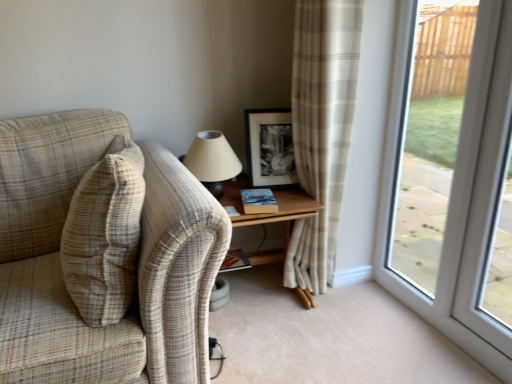
Question: Is black matte picture frame at upper center closer to camera compared to matte beige lampshade at upper center?

Choices:
 (A) yes
 (B) no

Answer: (B)

Question: Does black matte picture frame at upper center have a greater width compared to matte beige lampshade at upper center?

Choices:
 (A) no
 (B) yes

Answer: (A)

Question: From a real-world perspective, is black matte picture frame at upper center physically below matte beige lampshade at upper center?

Choices:
 (A) no
 (B) yes

Answer: (A)

Question: Is matte beige lampshade at upper center at the back of black matte picture frame at upper center?

Choices:
 (A) yes
 (B) no

Answer: (B)

Question: Is black matte picture frame at upper center further to camera compared to matte beige lampshade at upper center?

Choices:
 (A) no
 (B) yes

Answer: (B)

Question: Do you think hardcover book at center, the second book viewed from the left, is within black matte picture frame at upper center, or outside of it?

Choices:
 (A) outside
 (B) inside

Answer: (A)

Question: From a real-world perspective, is hardcover book at center, marked as the 1th book in a front-to-back arrangement, physically located above or below black matte picture frame at upper center?

Choices:
 (A) above
 (B) below

Answer: (B)

Question: Would you say hardcover book at center, the 2th book ordered from the bottom, is to the left or to the right of black matte picture frame at upper center in the picture?

Choices:
 (A) right
 (B) left

Answer: (B)

Question: Considering the positions of hardcover book at center, which is the first book from top to bottom, and black matte picture frame at upper center in the image, is hardcover book at center, which is the first book from top to bottom, taller or shorter than black matte picture frame at upper center?

Choices:
 (A) tall
 (B) short

Answer: (B)

Question: From the image's perspective, is hardcover book at center, the second book when ordered from right to left, above or below matte beige lampshade at upper center?

Choices:
 (A) above
 (B) below

Answer: (B)

Question: Looking at the image, does hardcover book at center, the 1th book from the back, seem bigger or smaller compared to matte beige lampshade at upper center?

Choices:
 (A) big
 (B) small

Answer: (B)

Question: From a real-world perspective, relative to matte beige lampshade at upper center, is hardcover book at center, the 1th book from the back, vertically above or below?

Choices:
 (A) above
 (B) below

Answer: (B)

Question: Relative to matte beige lampshade at upper center, is hardcover book at center, which ranks as the 1th book in left-to-right order, in front or behind?

Choices:
 (A) behind
 (B) front

Answer: (A)

Question: Looking at their shapes, would you say wooden table at center is wider or thinner than hardcover book at center, the first book from the bottom?

Choices:
 (A) wide
 (B) thin

Answer: (A)

Question: Is wooden table at center to the left or to the right of hardcover book at center, marked as the 2th book in a top-to-bottom arrangement, in the image?

Choices:
 (A) left
 (B) right

Answer: (B)